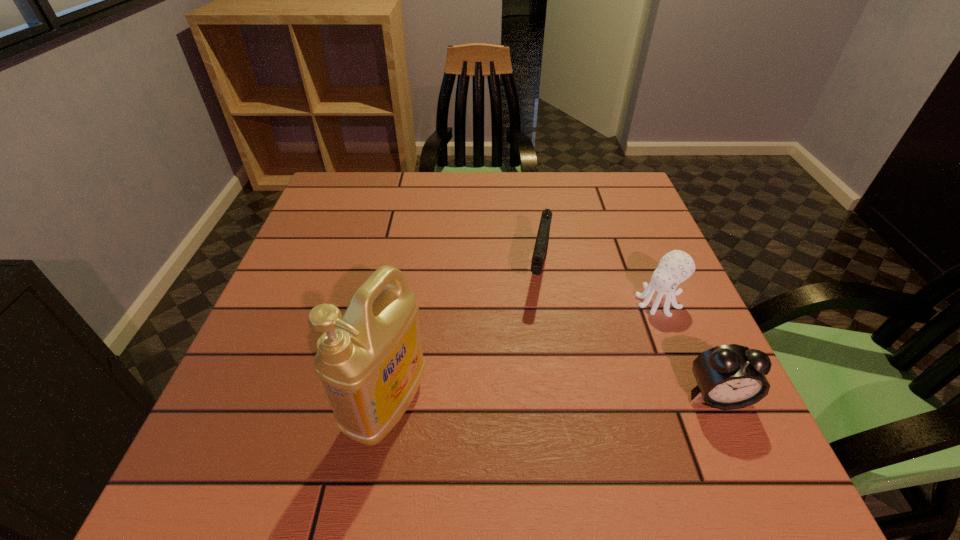
Image resolution: width=960 pixels, height=540 pixels. I want to click on free space located 0.240m on the front-facing side of the octopus, so click(569, 373).

What are the coordinates of `free spot located on the front-facing side of the octopus` in the screenshot? It's located at (631, 324).

The height and width of the screenshot is (540, 960). What are the coordinates of `detergent that is at the near edge` in the screenshot? It's located at (370, 361).

What are the coordinates of `alarm clock at the near edge` in the screenshot? It's located at (732, 376).

Locate an element on the screen. The image size is (960, 540). alarm clock at the right edge is located at coordinates (732, 376).

Locate an element on the screen. This screenshot has width=960, height=540. octopus at the right edge is located at coordinates (675, 267).

The height and width of the screenshot is (540, 960). Identify the location of object present at the near right corner. (732, 376).

In order to click on vacant space at the far edge of the desktop in this screenshot , I will do `click(577, 204)`.

In the image, there is a desktop. At what (x,y) coordinates should I click in order to perform the action: click on vacant area at the near edge. Please return your answer as a coordinate pair (x, y). The width and height of the screenshot is (960, 540). Looking at the image, I should click on (484, 422).

Where is `free space at the left edge`? Image resolution: width=960 pixels, height=540 pixels. free space at the left edge is located at coordinates (364, 221).